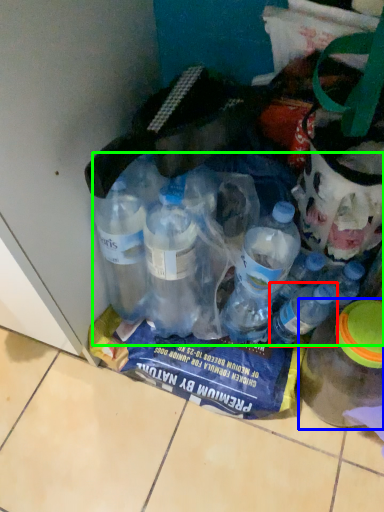
Question: Based on their relative distances, which object is farther from bottle (highlighted by a red box)? Choose from bottle (highlighted by a blue box) and bottle (highlighted by a green box).

Choices:
 (A) bottle
 (B) bottle

Answer: (B)